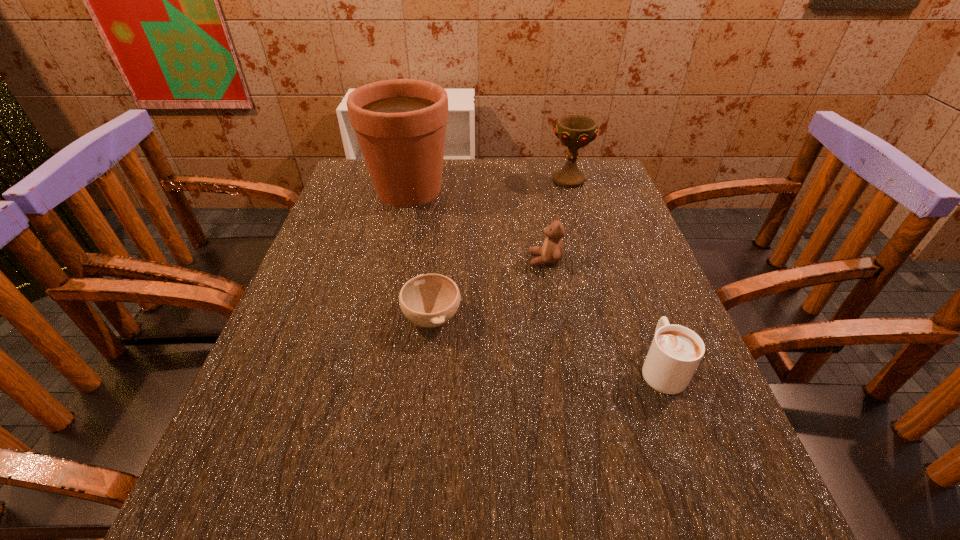
The image size is (960, 540). I want to click on free space that satisfies the following two spatial constraints: 1. on the side with the handle of the second shortest object; 2. on the front-facing side of the teddy bear, so click(x=621, y=260).

This screenshot has height=540, width=960. In order to click on free space that satisfies the following two spatial constraints: 1. on the front-facing side of the third object from right to left; 2. on the side with the handle of the cappuccino in this screenshot , I will do `click(564, 367)`.

Identify the location of free space that satisfies the following two spatial constraints: 1. on the side with the handle of the second shortest object; 2. on the front-facing side of the third tallest object. This screenshot has width=960, height=540. (621, 260).